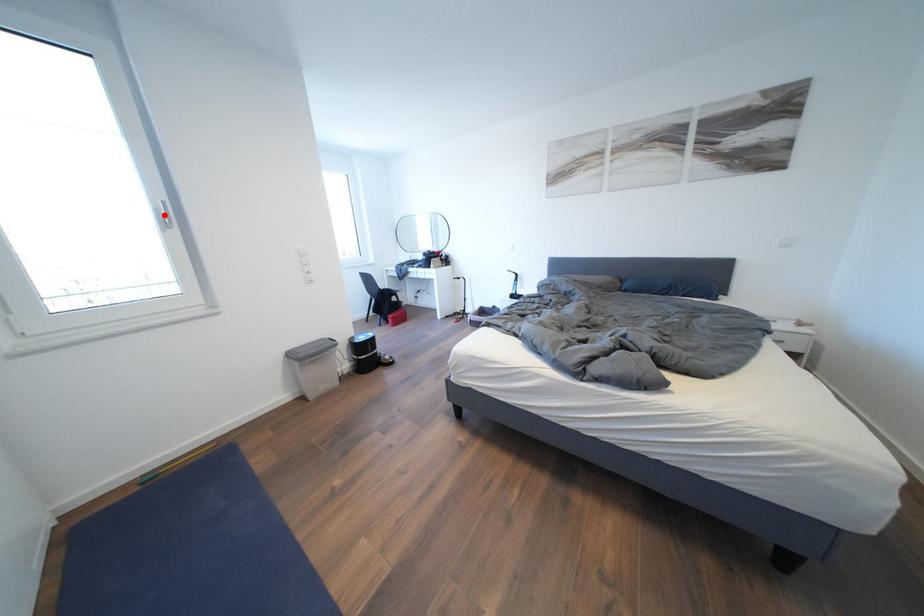
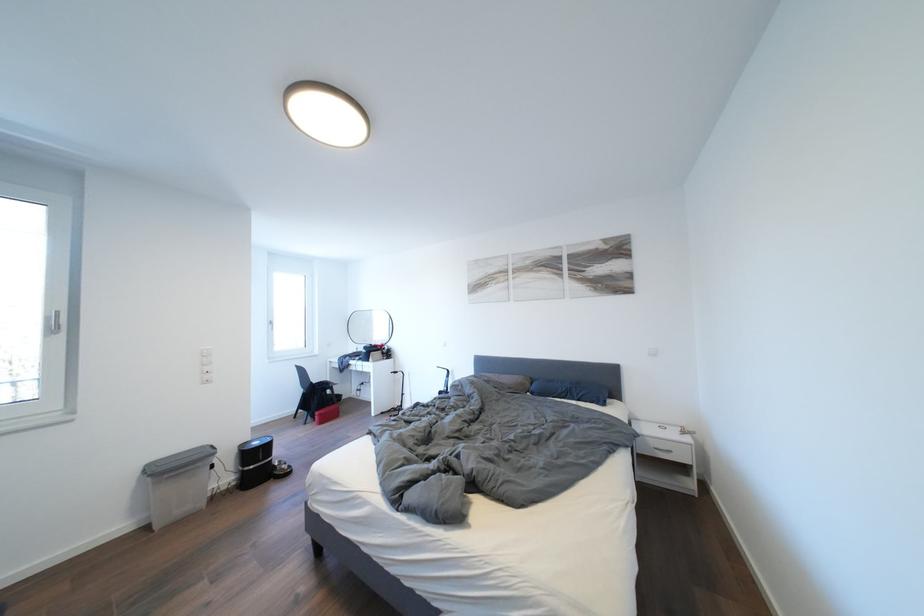
Where in the second image is the point corresponding to the highlighted location from the first image?

(56, 323)